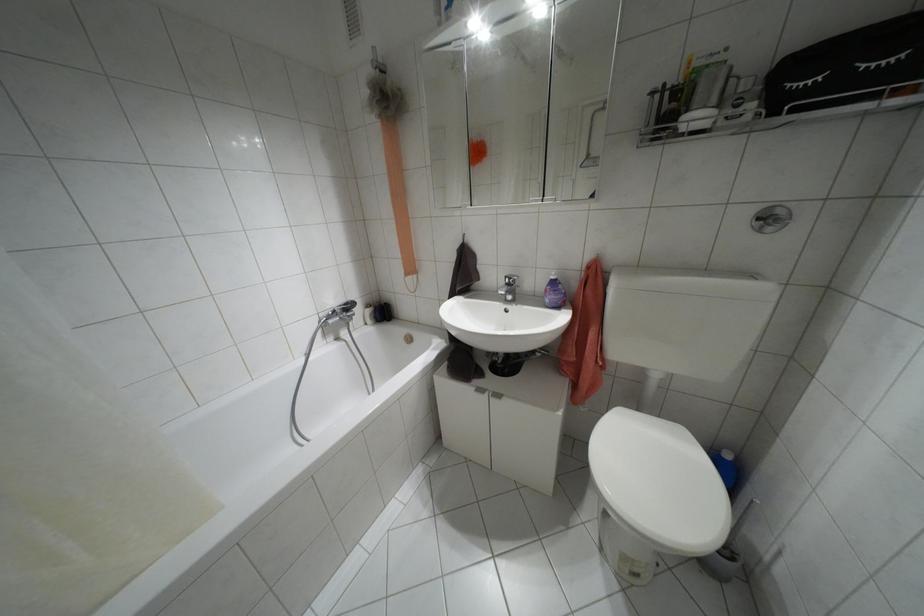
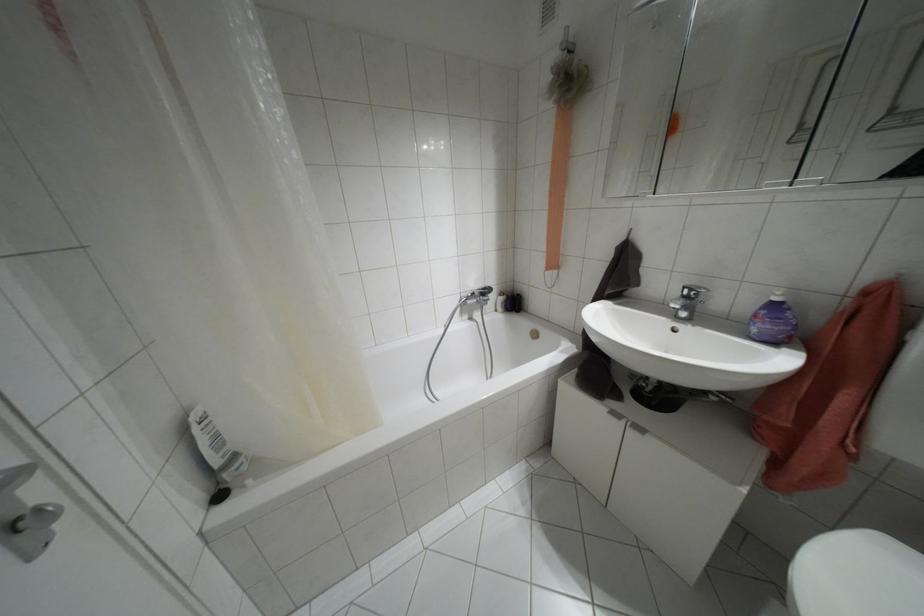
Question: In a continuous first-person perspective shot, in which direction is the camera moving?

Choices:
 (A) Left
 (B) Right
 (C) Forward
 (D) Backward

Answer: (A)